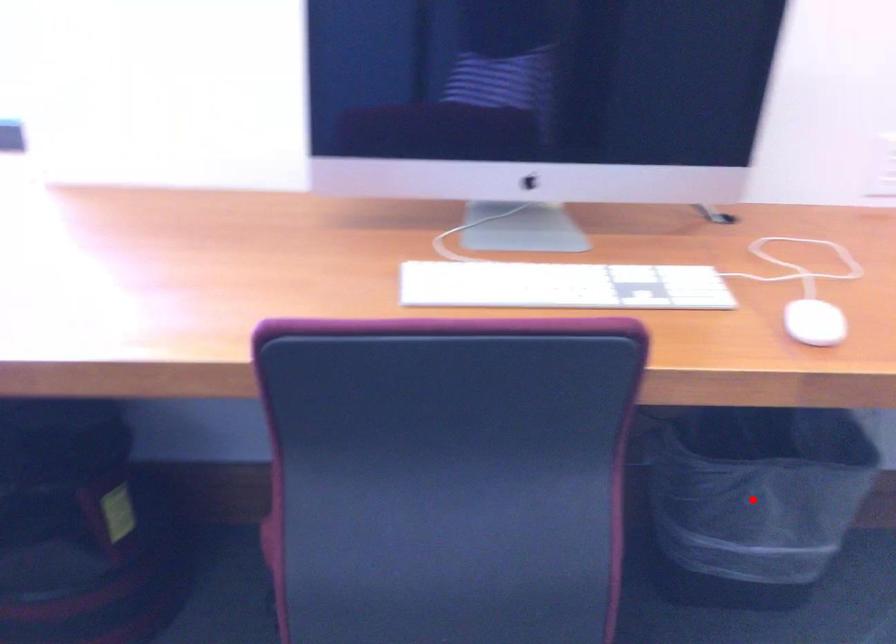
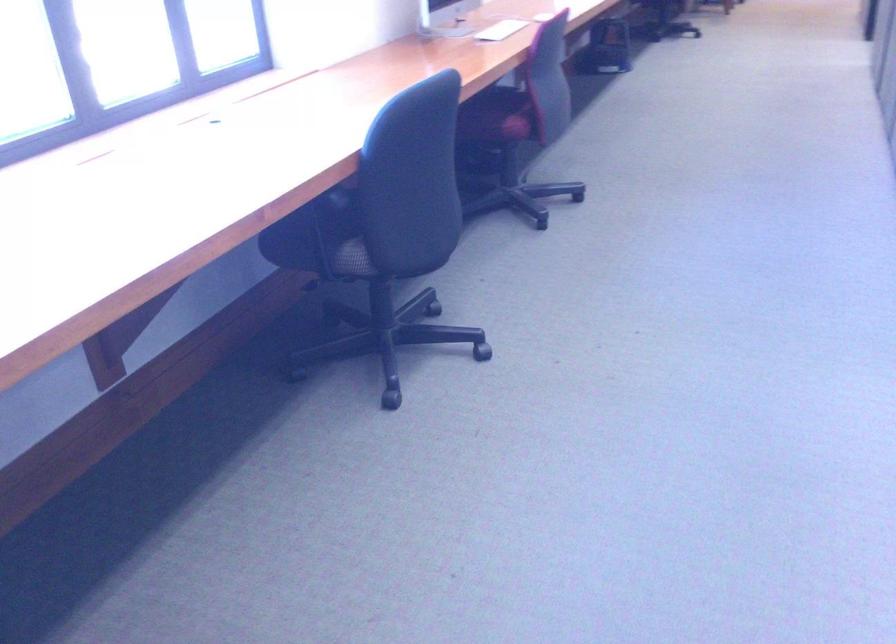
Question: I am providing you with two images of the same scene from different viewpoints. A red point is marked on the first image. Can you still see the location of the red point in image 2?

Choices:
 (A) Yes
 (B) No

Answer: (B)